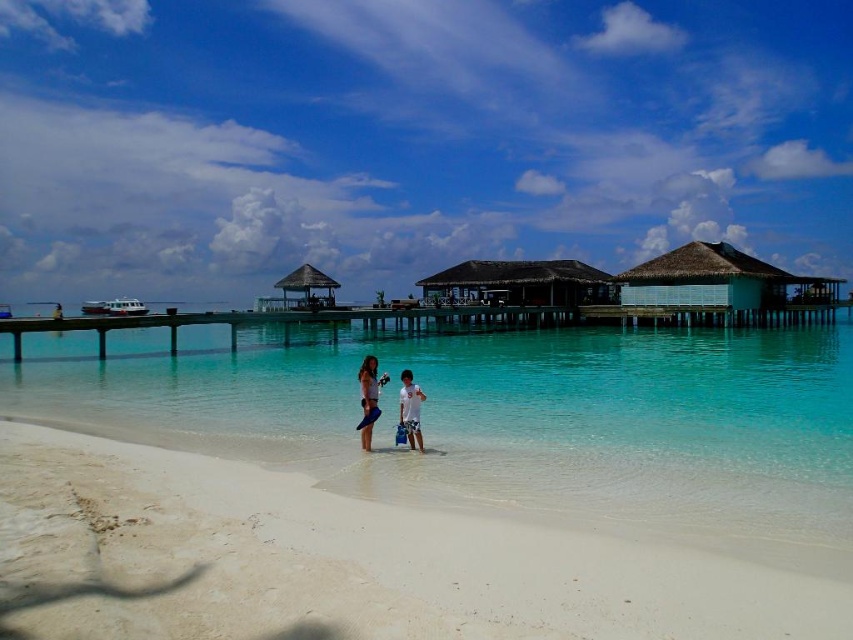
Question: Is white sandy beach at lower center closer to camera compared to white cotton shirt at center?

Choices:
 (A) yes
 (B) no

Answer: (A)

Question: Which point is farther to the camera?

Choices:
 (A) (376, 410)
 (B) (740, 280)
 (C) (573, 438)
 (D) (303, 278)

Answer: (D)

Question: Does white cotton t-shirt at center come behind brown thatched hut at center?

Choices:
 (A) no
 (B) yes

Answer: (A)

Question: Which of the following is the farthest from the observer?

Choices:
 (A) (329, 276)
 (B) (374, 362)
 (C) (403, 419)
 (D) (155, 352)

Answer: (A)

Question: Which object is the closest to the white cotton shirt at center?

Choices:
 (A) light blue thatched roof hut at right
 (B) white sandy beach at lower center
 (C) brown thatched roof hut at center
 (D) clear blue water at center

Answer: (B)

Question: Does light blue thatched roof hut at right have a smaller size compared to brown thatched hut at center?

Choices:
 (A) yes
 (B) no

Answer: (B)